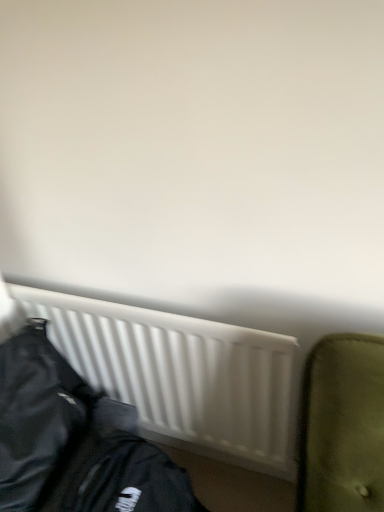
Question: From the image's perspective, is black leather jacket at lower left located beneath white matte radiator at lower center?

Choices:
 (A) no
 (B) yes

Answer: (B)

Question: Considering the relative sizes of black leather jacket at lower left and white matte radiator at lower center in the image provided, is black leather jacket at lower left wider than white matte radiator at lower center?

Choices:
 (A) no
 (B) yes

Answer: (B)

Question: Considering the relative sizes of black leather jacket at lower left and white matte radiator at lower center in the image provided, is black leather jacket at lower left shorter than white matte radiator at lower center?

Choices:
 (A) no
 (B) yes

Answer: (B)

Question: Can you confirm if black leather jacket at lower left is positioned to the left of white matte radiator at lower center?

Choices:
 (A) yes
 (B) no

Answer: (A)

Question: Can you confirm if black leather jacket at lower left is positioned to the right of white matte radiator at lower center?

Choices:
 (A) no
 (B) yes

Answer: (A)

Question: Can you confirm if black leather jacket at lower left is taller than white matte radiator at lower center?

Choices:
 (A) no
 (B) yes

Answer: (A)

Question: Considering the relative sizes of white matte radiator at lower center and black leather jacket at lower left in the image provided, is white matte radiator at lower center bigger than black leather jacket at lower left?

Choices:
 (A) no
 (B) yes

Answer: (B)

Question: Considering the relative sizes of white matte radiator at lower center and black leather jacket at lower left in the image provided, is white matte radiator at lower center wider than black leather jacket at lower left?

Choices:
 (A) no
 (B) yes

Answer: (A)

Question: Can you confirm if white matte radiator at lower center is positioned to the left of black leather jacket at lower left?

Choices:
 (A) yes
 (B) no

Answer: (B)

Question: From the image's perspective, is white matte radiator at lower center under black leather jacket at lower left?

Choices:
 (A) yes
 (B) no

Answer: (B)

Question: Does white matte radiator at lower center appear on the right side of black leather jacket at lower left?

Choices:
 (A) no
 (B) yes

Answer: (B)

Question: From the image's perspective, does white matte radiator at lower center appear higher than black leather jacket at lower left?

Choices:
 (A) yes
 (B) no

Answer: (A)

Question: Is black leather jacket at lower left in front of or behind white matte radiator at lower center in the image?

Choices:
 (A) front
 (B) behind

Answer: (A)